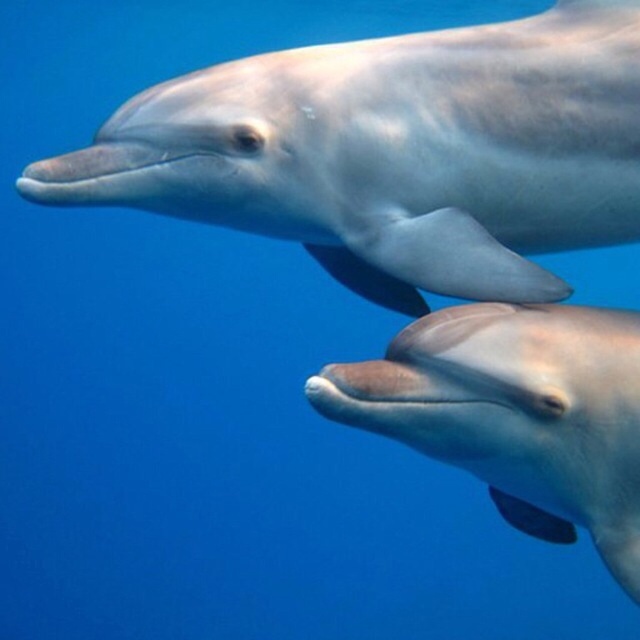
Question: Which point is farther from the camera taking this photo?

Choices:
 (A) (106, 204)
 (B) (572, 420)

Answer: (A)

Question: Does sleek silver dolphin at upper center have a larger size compared to smooth gray dolphin at center?

Choices:
 (A) yes
 (B) no

Answer: (A)

Question: Which point is closer to the camera?

Choices:
 (A) sleek silver dolphin at upper center
 (B) smooth gray dolphin at center

Answer: (B)

Question: Where is sleek silver dolphin at upper center located in relation to smooth gray dolphin at center in the image?

Choices:
 (A) below
 (B) above

Answer: (B)

Question: Which point is farther from the camera taking this photo?

Choices:
 (A) (362, 125)
 (B) (509, 506)

Answer: (B)

Question: Can you confirm if sleek silver dolphin at upper center is bigger than smooth gray dolphin at center?

Choices:
 (A) no
 (B) yes

Answer: (B)